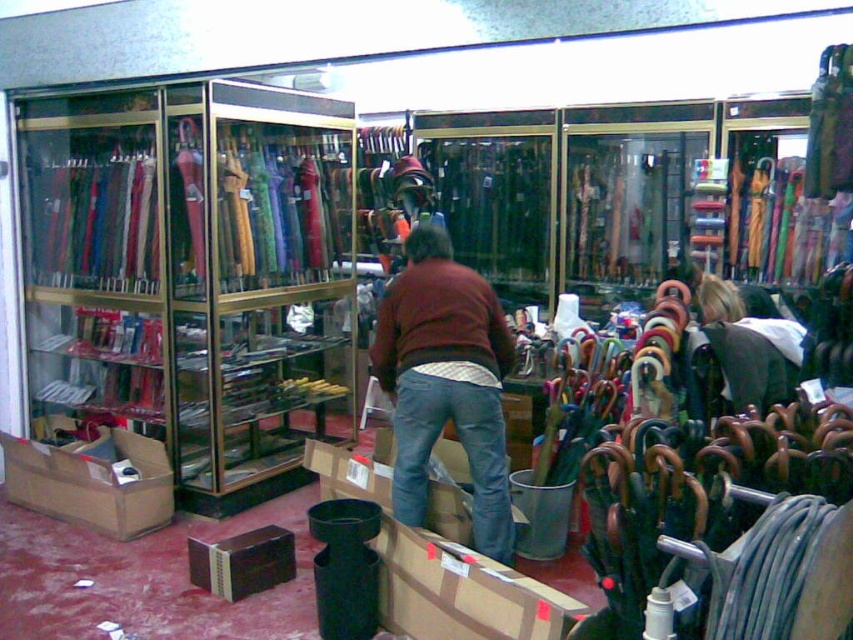
Does brown cardboard box at center have a greater height compared to cardboard box at lower left?

No, brown cardboard box at center is not taller than cardboard box at lower left.

Who is more forward, (386, 627) or (173, 508)?

Point (386, 627)

Is point (476, 616) farther from camera compared to point (100, 528)?

No, it is in front of (100, 528).

This screenshot has height=640, width=853. What are the coordinates of `brown cardboard box at center` in the screenshot? It's located at (462, 593).

Who is more forward, (57, 97) or (56, 497)?

Point (56, 497) is more forward.

Does metallic glass umbrella stand at left appear on the right side of cardboard box at lower left?

Yes, metallic glass umbrella stand at left is to the right of cardboard box at lower left.

Which is behind, point (93, 385) or point (12, 444)?

Positioned behind is point (93, 385).

Image resolution: width=853 pixels, height=640 pixels. Find the location of `metallic glass umbrella stand at left`. metallic glass umbrella stand at left is located at coordinates (193, 275).

How distant is metallic glass umbrella stand at left from white fabric umbrella at right?

metallic glass umbrella stand at left is 2.39 meters away from white fabric umbrella at right.

Is metallic glass umbrella stand at left closer to the viewer compared to white fabric umbrella at right?

No, metallic glass umbrella stand at left is behind white fabric umbrella at right.

Locate an element on the screen. Image resolution: width=853 pixels, height=640 pixels. metallic glass umbrella stand at left is located at coordinates (193, 275).